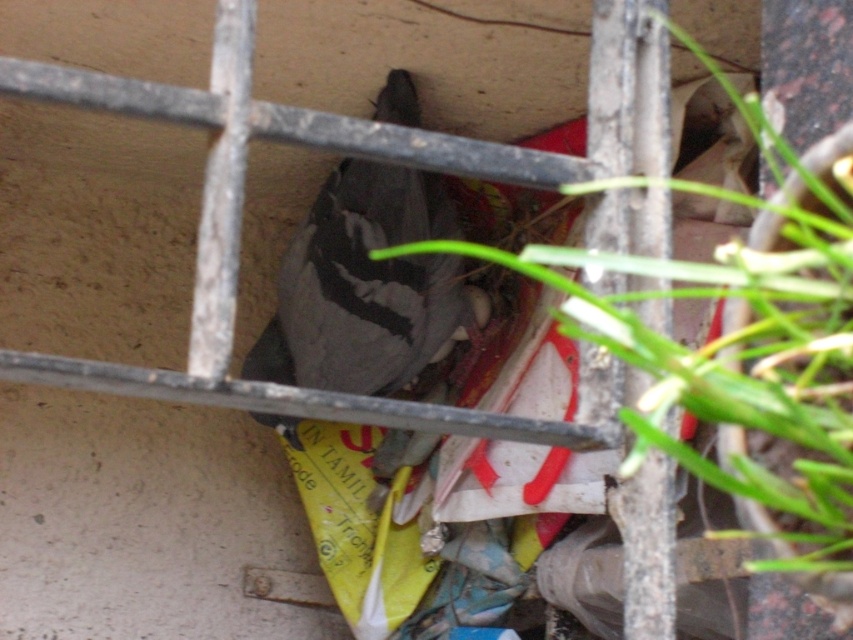
Question: In this image, where is green leafy plant at center located relative to gray matte bird at center?

Choices:
 (A) left
 (B) right

Answer: (B)

Question: Which object appears farthest from the camera in this image?

Choices:
 (A) green leafy plant at center
 (B) gray matte bird at center

Answer: (B)

Question: Is green leafy plant at center closer to camera compared to gray matte bird at center?

Choices:
 (A) no
 (B) yes

Answer: (B)

Question: Which object appears farthest from the camera in this image?

Choices:
 (A) gray matte bird at center
 (B) green leafy plant at center

Answer: (A)

Question: Is green leafy plant at center above gray matte bird at center?

Choices:
 (A) yes
 (B) no

Answer: (B)